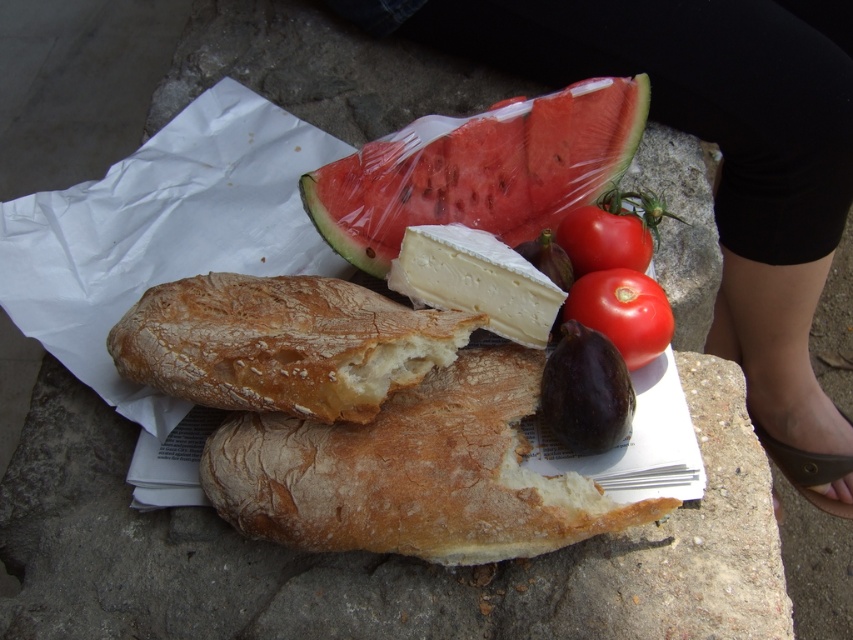
Consider the image. You are at a picnic and want to grab the brown crusty bread at center and the purple matte eggplant at center. Which one can you reach first without moving your position?

The brown crusty bread at center is closer to the viewer than the purple matte eggplant at center, so you can reach it first without moving.

You are a photographer trying to capture the brown crusty bread at center without any obstructions. There is a black fabric leg at upper center in the way. Can you move the leg closer than 60 centimeters to the bread to frame the shot better?

The black fabric leg at upper center is 63.15 centimeters away from the brown crusty bread at center. Moving it closer than 60 centimeters would require reducing the distance by about 3.15 centimeters, which is possible if you adjust its position carefully.

What is the 2D coordinate of the black fabric leg at upper center in the image?

The black fabric leg at upper center is located at the 2D coordinate point of (720, 163).